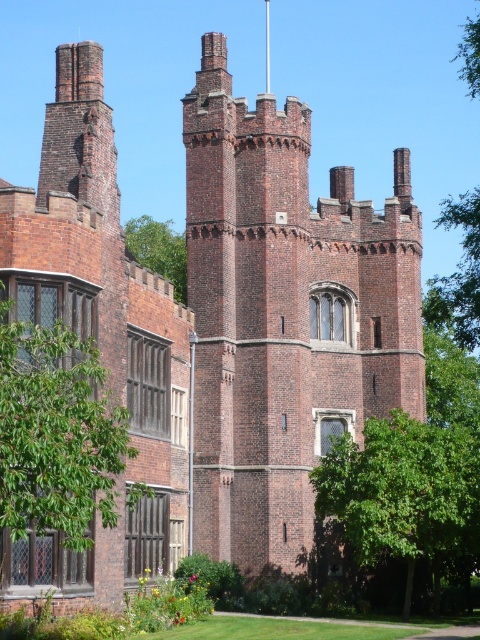
You are standing at the base of the historic brick building and notice two points marked on the tower. The first point is at coordinates point (2,477) and the second is at point (393,420). Which point is closer to your current position?

Point (2,477) is in front of point (393,420), so it is closer to your current position at the base of the building.

You are standing at the center of the historic brick building shown in the image. Looking towards the left side of the building, you notice a point marked at coordinates (x=57, y=433). What object is located at this point?

The point at coordinates (x=57, y=433) corresponds to the green leafy tree at left.